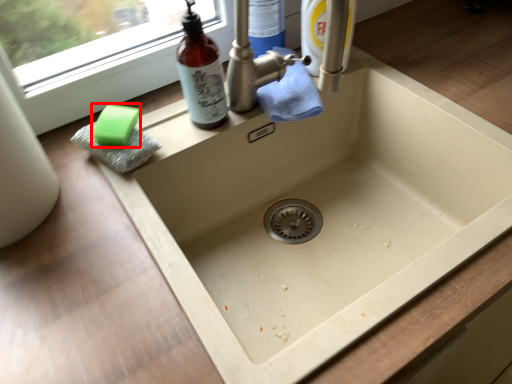
Question: Considering the relative positions of soap (annotated by the red box) and bottle in the image provided, where is soap (annotated by the red box) located with respect to the staircase?

Choices:
 (A) right
 (B) left

Answer: (B)